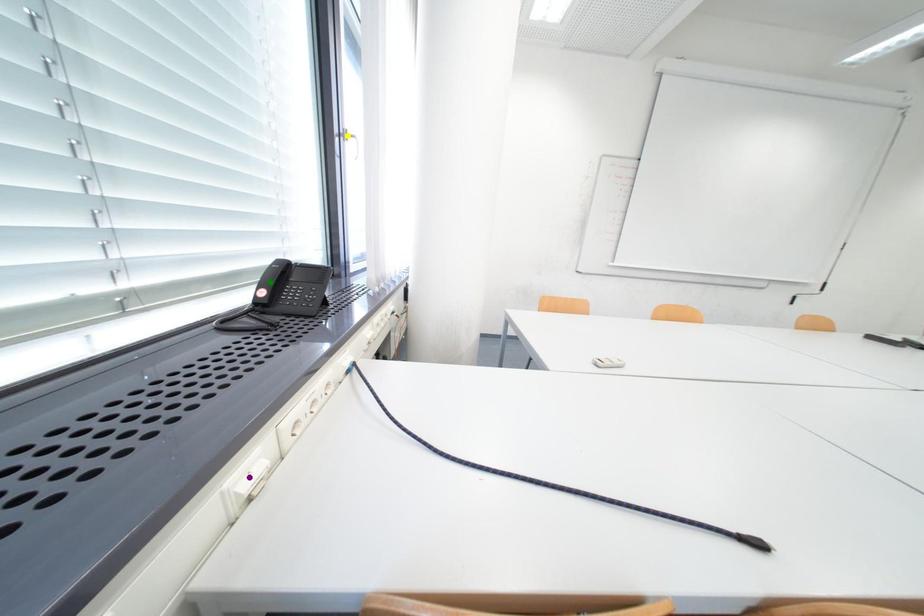
Order these from nearest to farthest:
green point, yellow point, purple point

1. yellow point
2. green point
3. purple point